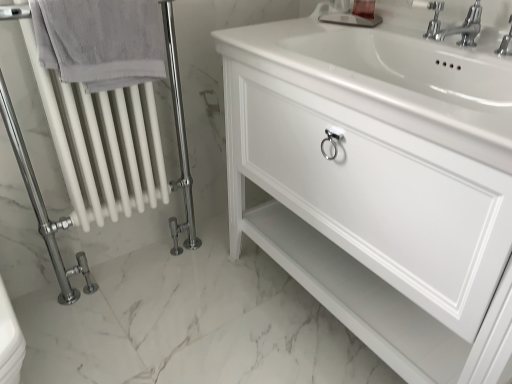
This screenshot has height=384, width=512. I want to click on spots to the right of clear plastic soap at upper center, so click(397, 24).